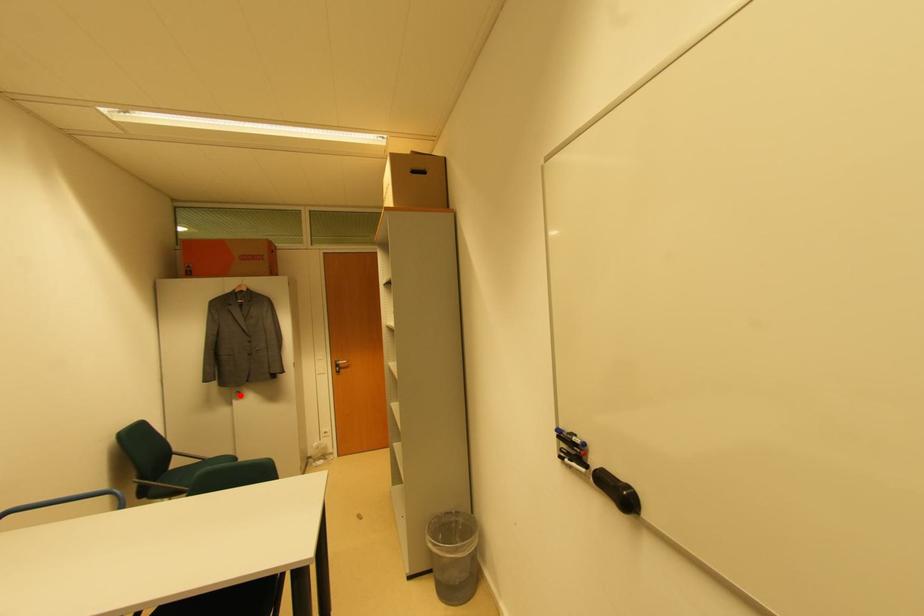
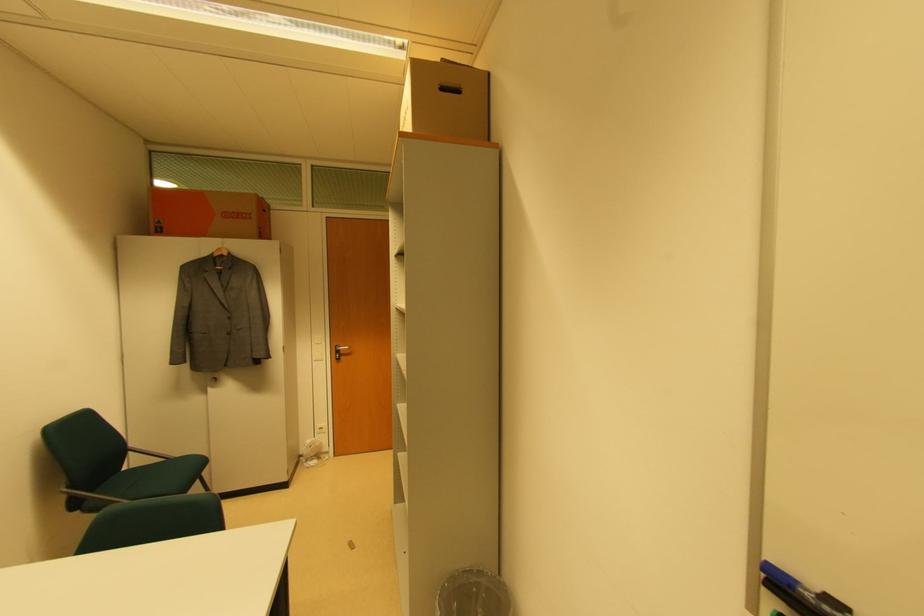
Locate, in the second image, the point that corresponds to the highlighted location in the first image.

(216, 382)